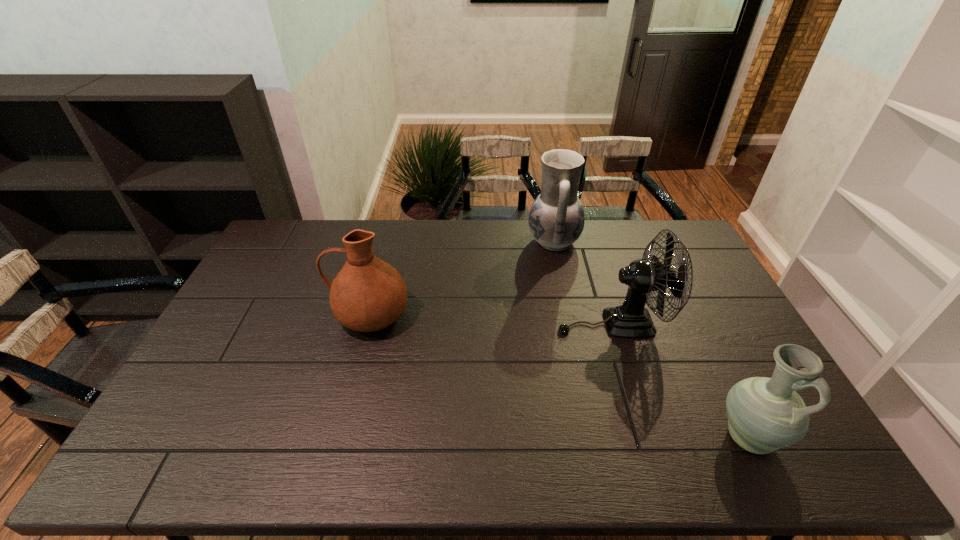
The height and width of the screenshot is (540, 960). Find the location of `free space between the leftmost object and the fan`. free space between the leftmost object and the fan is located at coordinates (491, 319).

Image resolution: width=960 pixels, height=540 pixels. I want to click on vacant area that lies between the fan and the leftmost object, so click(x=491, y=319).

Identify the location of unoccupied area between the leftmost object and the farthest pitcher. The height and width of the screenshot is (540, 960). (462, 278).

The width and height of the screenshot is (960, 540). Identify the location of free area in between the fan and the leftmost object. (491, 319).

Identify the location of vacant area between the fan and the leftmost pitcher. (491, 319).

The height and width of the screenshot is (540, 960). In order to click on the second closest object to the nearest pitcher in this screenshot , I will do `click(556, 219)`.

Where is `object that is the second closest to the rightmost pitcher`? This screenshot has width=960, height=540. object that is the second closest to the rightmost pitcher is located at coordinates (556, 219).

At what (x,y) coordinates should I click in order to perform the action: click on pitcher that stands as the closest to the nearest pitcher. Please return your answer as a coordinate pair (x, y). The height and width of the screenshot is (540, 960). Looking at the image, I should click on (556, 219).

Image resolution: width=960 pixels, height=540 pixels. I want to click on pitcher that is the second closest to the rightmost pitcher, so click(x=367, y=294).